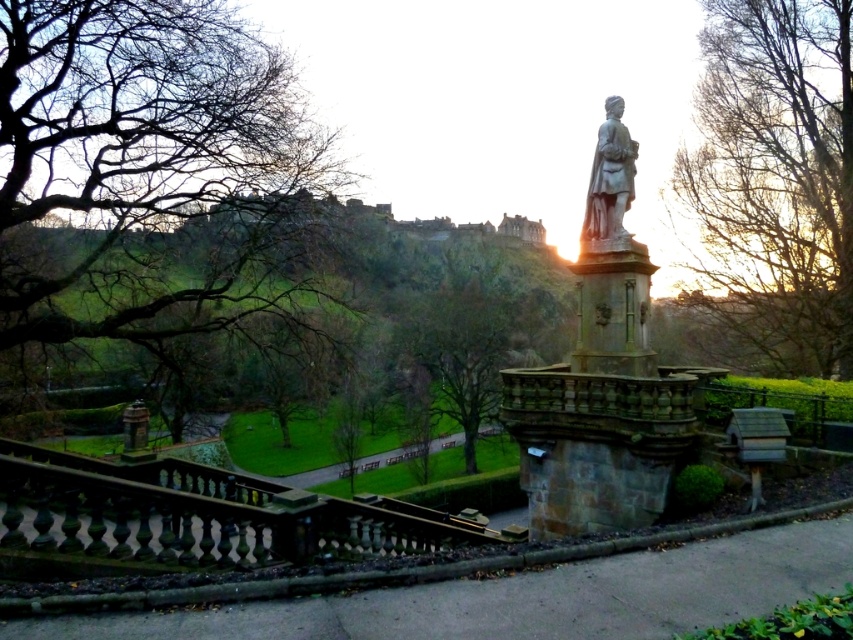
You are a park visitor who wants to take a photo of the gray stone statue at center. However, there are bare branches at upper right in the way. Can you tell me whether the branches are wider than the statue?

The bare branches at upper right are wider than the gray stone statue at center, so they might block the view of the statue in your photo.